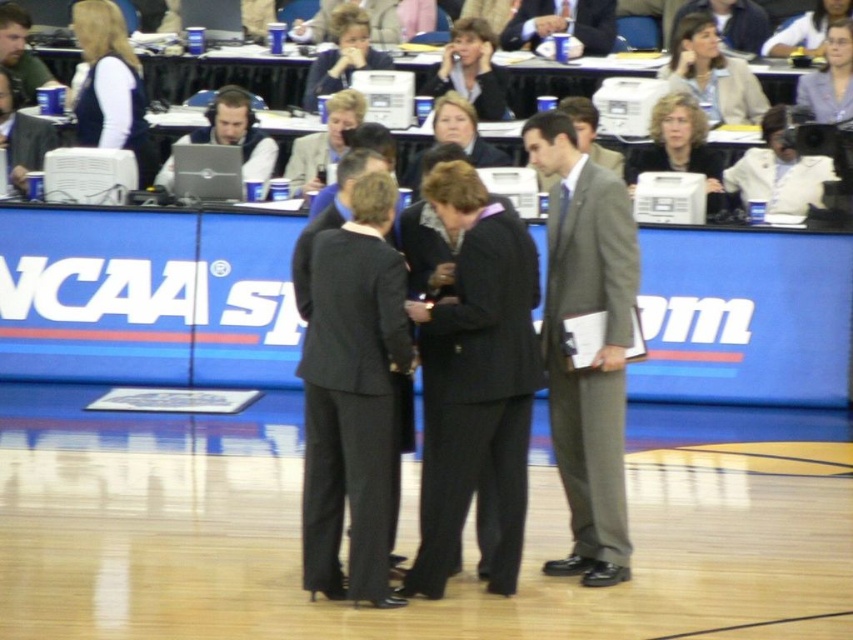
Question: Which object appears farthest from the camera in this image?

Choices:
 (A) dark gray wool suit at center
 (B) gray wool suit at center
 (C) black pinstripe suit at center
 (D) matte black suit at upper center

Answer: (D)

Question: Is black pinstripe suit at center to the right of matte black suit at upper center from the viewer's perspective?

Choices:
 (A) yes
 (B) no

Answer: (B)

Question: Does dark gray wool suit at center have a lesser width compared to matte black suit at upper center?

Choices:
 (A) no
 (B) yes

Answer: (B)

Question: Which is nearer to the gray wool suit at center?

Choices:
 (A) matte black suit at upper center
 (B) black pinstripe suit at center
 (C) dark gray suit at center
 (D) matte black laptop at upper left

Answer: (C)

Question: Is dark gray wool suit at center below matte black laptop at upper left?

Choices:
 (A) yes
 (B) no

Answer: (A)

Question: Which of the following is the closest to the observer?

Choices:
 (A) black pinstripe suit at center
 (B) dark gray wool suit at center
 (C) dark gray suit at center
 (D) gray wool suit at center

Answer: (B)